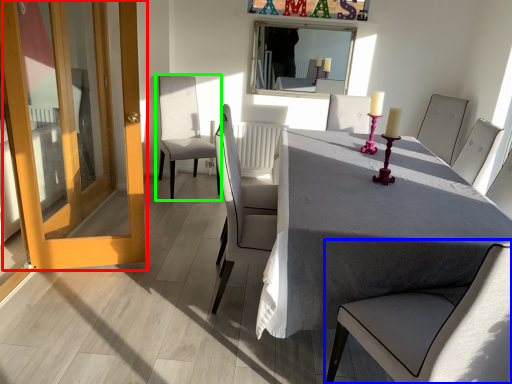
Question: Which is farther away from door (highlighted by a red box)? chair (highlighted by a blue box) or chair (highlighted by a green box)?

Choices:
 (A) chair
 (B) chair

Answer: (A)